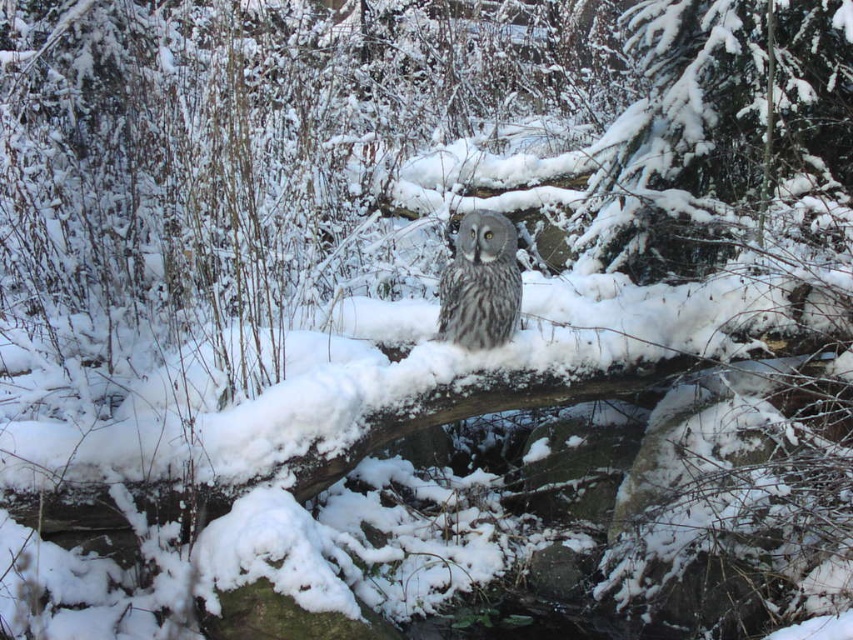
You are standing in the snowy forest scene. There is a point marked at coordinate (720,124). What object is located at that point?

The point at coordinate (720,124) indicates a snow covered evergreen tree at center.